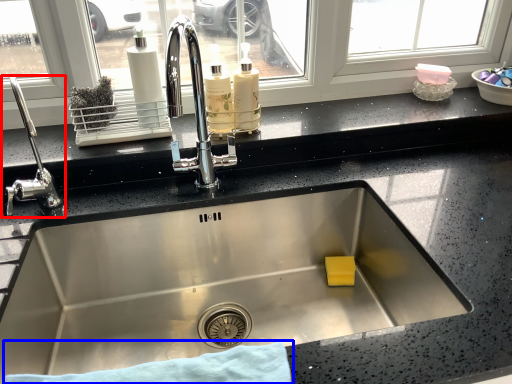
Question: Which object appears farthest to the camera in this image, tap (highlighted by a red box) or bath towel (highlighted by a blue box)?

Choices:
 (A) tap
 (B) bath towel

Answer: (A)